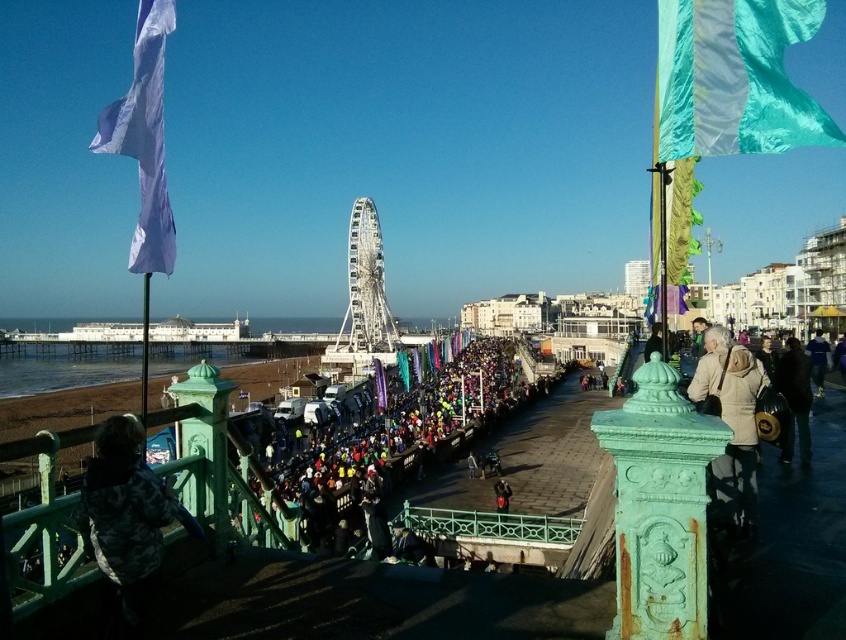
Who is more distant from viewer, (117, 525) or (805, 349)?

The point (805, 349) is behind.

Where is `camouflage jacket at lower left`? This screenshot has height=640, width=846. camouflage jacket at lower left is located at coordinates (125, 522).

Who is lower down, smooth concrete dock at center or multicolored fabric crowd at center?

smooth concrete dock at center is below.

Who is taller, smooth concrete dock at center or multicolored fabric crowd at center?

Standing taller between the two is multicolored fabric crowd at center.

Image resolution: width=846 pixels, height=640 pixels. I want to click on smooth concrete dock at center, so click(536, 490).

Can you confirm if beige woolen jacket at right is positioned above dark blue leather jacket at lower right?

Correct, beige woolen jacket at right is located above dark blue leather jacket at lower right.

Can you confirm if beige woolen jacket at right is bigger than dark blue leather jacket at lower right?

Yes, beige woolen jacket at right is bigger than dark blue leather jacket at lower right.

You are a GUI agent. You are given a task and a screenshot of the screen. Output one action in this format:
    pyautogui.click(x=<x>, y=<y>)
    Task: Click on the beige woolen jacket at right
    Image resolution: width=846 pixels, height=640 pixels.
    Given the screenshot: What is the action you would take?
    pyautogui.click(x=731, y=422)